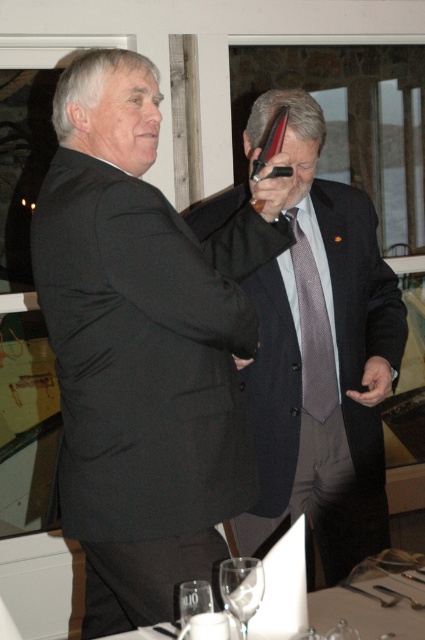
Question: Where is clear glassware at center located in relation to clear glass wine glass at lower center in the image?

Choices:
 (A) left
 (B) right

Answer: (A)

Question: Considering the real-world distances, which object is closest to the clear glass wine glass at center?

Choices:
 (A) transparent glass at lower center
 (B) clear glass wine glass at lower center

Answer: (B)

Question: Which object is closer to the camera taking this photo?

Choices:
 (A) black matte suit at left
 (B) clear glass wine glass at lower center
 (C) clear glassware at center

Answer: (B)

Question: Can you confirm if matte black suit at center is wider than gray textured tie at center?

Choices:
 (A) yes
 (B) no

Answer: (A)

Question: Among these objects, which one is nearest to the camera?

Choices:
 (A) clear glassware at center
 (B) matte black suit at center
 (C) clear glass wine glass at lower center

Answer: (C)

Question: Is gray textured tie at center in front of clear glass wine glass at center?

Choices:
 (A) no
 (B) yes

Answer: (A)